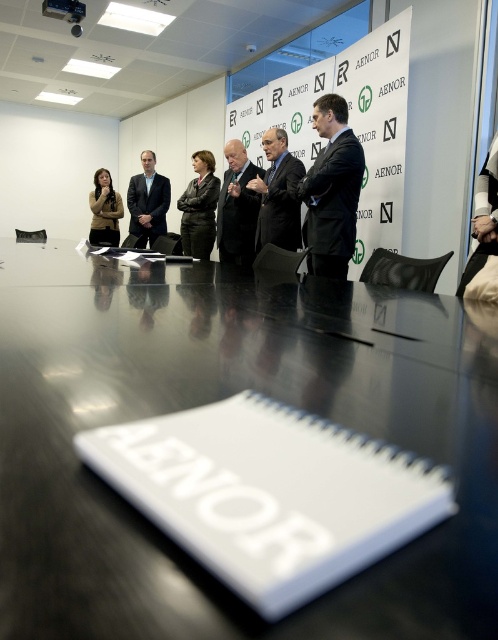
Who is higher up, dark gray suit at center or matte brown jacket at left?

matte brown jacket at left is higher up.

Does dark gray suit at center appear on the right side of matte brown jacket at left?

Indeed, dark gray suit at center is positioned on the right side of matte brown jacket at left.

Who is more distant from viewer, [320,256] or [116,237]?

The point [116,237] is behind.

What are the coordinates of `dark gray suit at center` in the screenshot? It's located at (333, 204).

Does dark blue fabric business suit at center have a larger size compared to matte brown jacket at left?

Actually, dark blue fabric business suit at center might be smaller than matte brown jacket at left.

Does point (152, 230) lie behind point (105, 244)?

No, it is in front of (105, 244).

Find the location of `dark blue fabric business suit at center`. dark blue fabric business suit at center is located at coordinates (147, 205).

Looking at this image, can you confirm if dark gray leather jacket at center is wider than matte brown jacket at left?

In fact, dark gray leather jacket at center might be narrower than matte brown jacket at left.

Between point (193, 214) and point (120, 195), which one is positioned behind?

Point (120, 195)

Where is `dark gray leather jacket at center`? This screenshot has height=640, width=498. dark gray leather jacket at center is located at coordinates (199, 208).